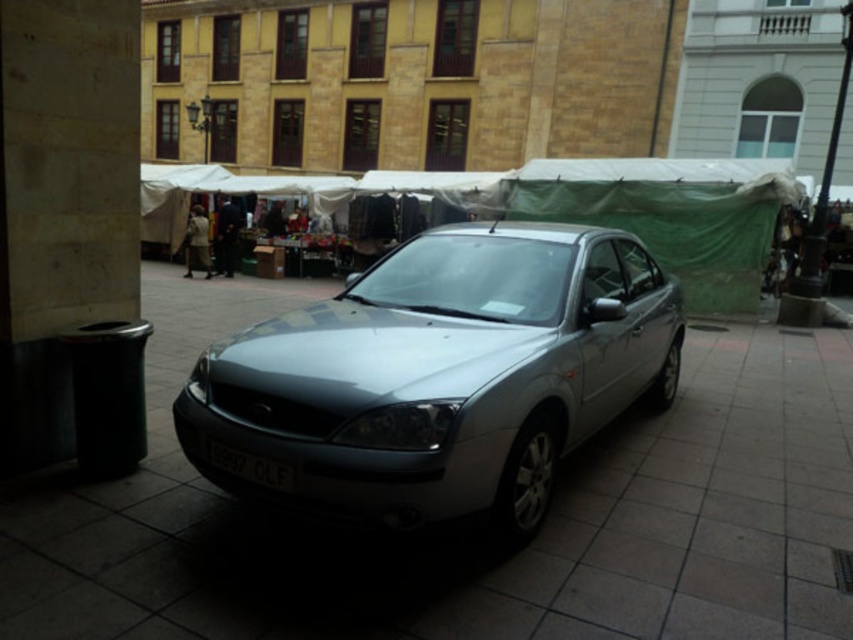
You are a delivery person trying to park your vehicle in the market square. You see the slate gray pavement at center and the satin silver car at center. Which area should you avoid to prevent blocking the entrance?

You should avoid parking on the satin silver car at center because it is farther from the viewer, meaning it is already parked and blocking the entrance. The slate gray pavement at center is closer to the viewer and likely a free parking spot.